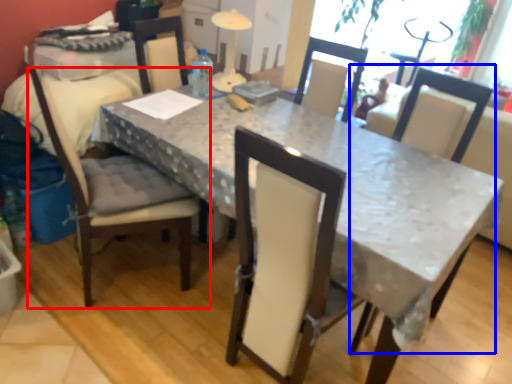
Question: Among these objects, which one is nearest to the camera, chair (highlighted by a red box) or chair (highlighted by a blue box)?

Choices:
 (A) chair
 (B) chair

Answer: (A)